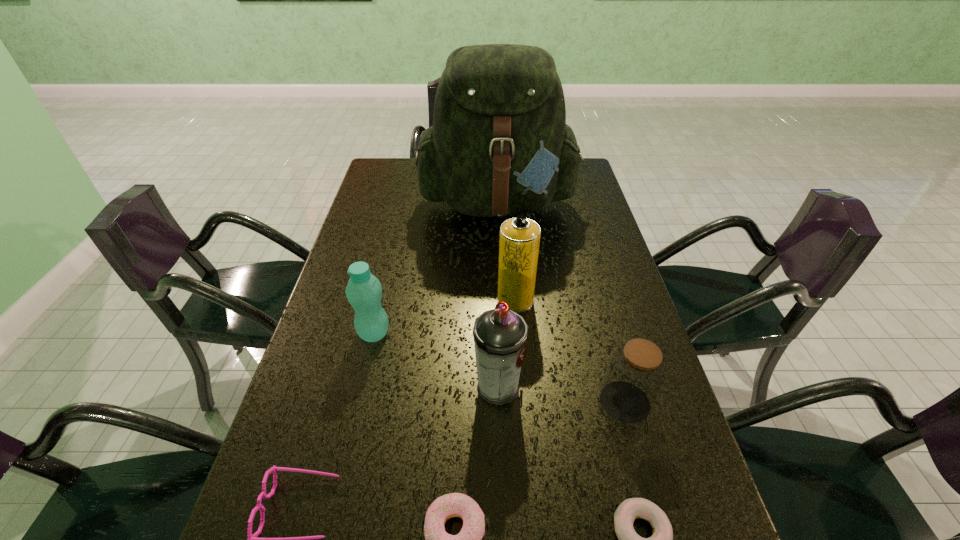
Where is `the farthest object`? Image resolution: width=960 pixels, height=540 pixels. the farthest object is located at coordinates (499, 145).

Locate an element on the screen. backpack is located at coordinates (499, 145).

Find the location of `the second farthest object`. the second farthest object is located at coordinates tap(519, 241).

Locate an element on the screen. This screenshot has height=540, width=960. the nearer aerosol can is located at coordinates (500, 334).

I want to click on the fourth tallest object, so click(363, 291).

Image resolution: width=960 pixels, height=540 pixels. Find the location of `bottle`. bottle is located at coordinates (363, 291).

Locate an element on the screen. jar is located at coordinates (635, 375).

Where is `free space located 0.080m on the open flap of the tallest object`? The width and height of the screenshot is (960, 540). free space located 0.080m on the open flap of the tallest object is located at coordinates (501, 258).

Locate an element on the screen. free region located 0.320m on the left of the second farthest object is located at coordinates (378, 300).

The height and width of the screenshot is (540, 960). Identify the location of vacant space situated on the back of the nearer aerosol can. (494, 280).